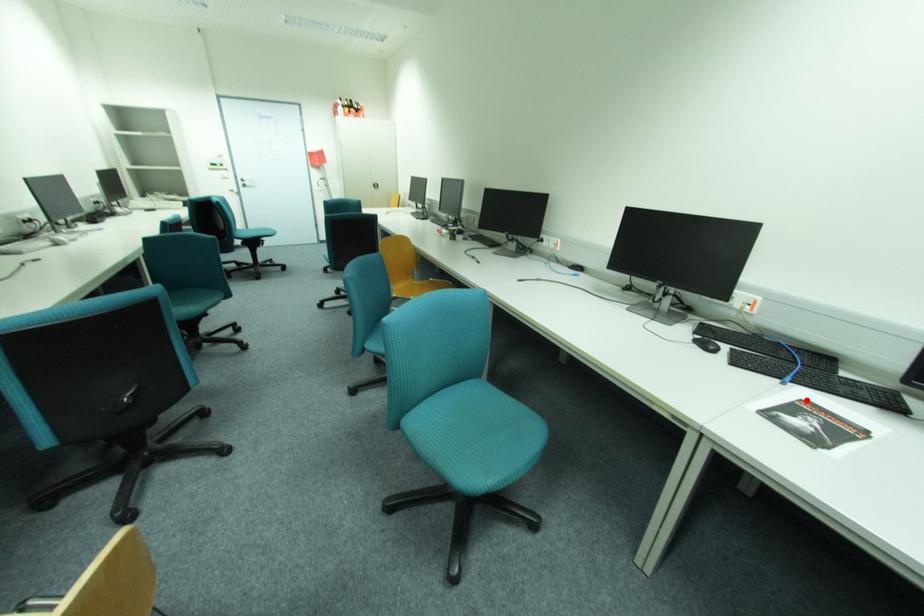
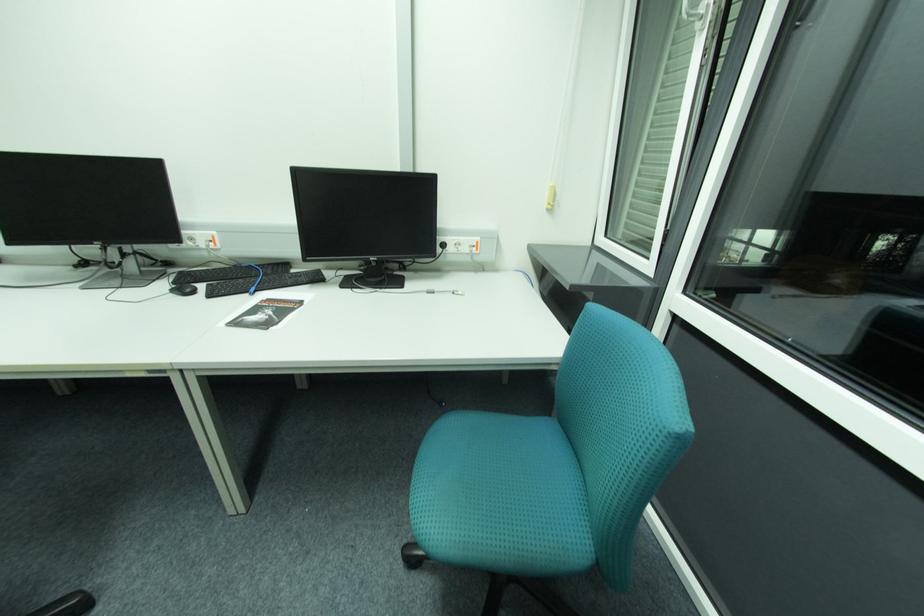
Question: I am providing you with two images of the same scene from different viewpoints. A red point is marked on the first image. Can you still see the location of the red point in image 2?

Choices:
 (A) Yes
 (B) No

Answer: (A)